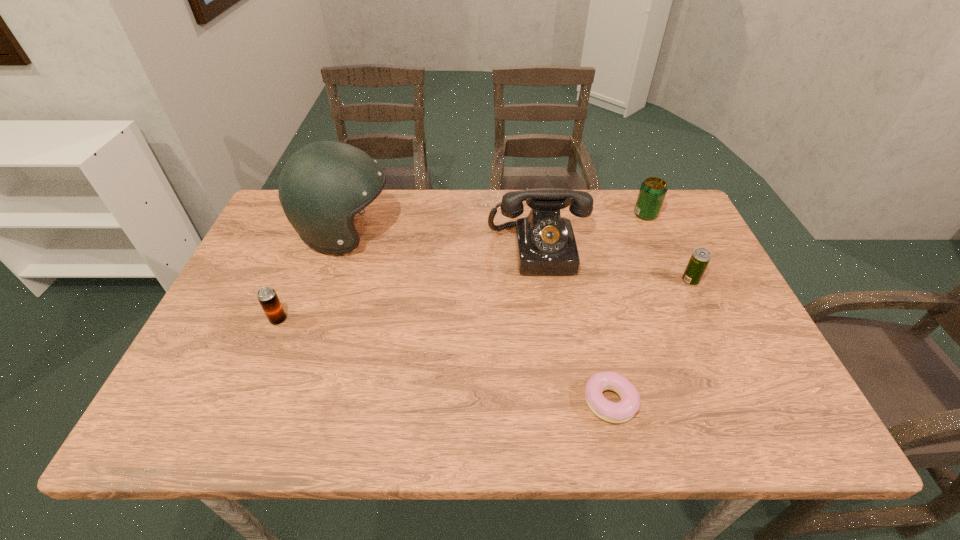
Locate an element on the screen. The height and width of the screenshot is (540, 960). free spot located on the front of the farthest beer can is located at coordinates (669, 268).

Find the location of a particular element. The width and height of the screenshot is (960, 540). vacant space located 0.100m on the left of the fifth farthest object is located at coordinates (228, 320).

Find the location of a particular element. free spot located on the right of the second nearest beer can is located at coordinates (722, 281).

The width and height of the screenshot is (960, 540). I want to click on vacant space located 0.390m on the back of the doughnut, so click(576, 254).

Identify the location of football helmet that is at the far edge. This screenshot has width=960, height=540. (323, 185).

Where is `telephone present at the far edge`? The height and width of the screenshot is (540, 960). telephone present at the far edge is located at coordinates (546, 245).

You are a GUI agent. You are given a task and a screenshot of the screen. Output one action in this format:
    pyautogui.click(x=<x>, y=<y>)
    Task: Click on the beer can that is at the far edge
    This screenshot has height=540, width=960.
    Given the screenshot: What is the action you would take?
    point(653,190)

Where is `object present at the near edge`? The width and height of the screenshot is (960, 540). object present at the near edge is located at coordinates (615, 412).

I want to click on football helmet located in the left edge section of the desktop, so click(323, 185).

Locate an element on the screen. beer can that is at the left edge is located at coordinates [x=267, y=296].